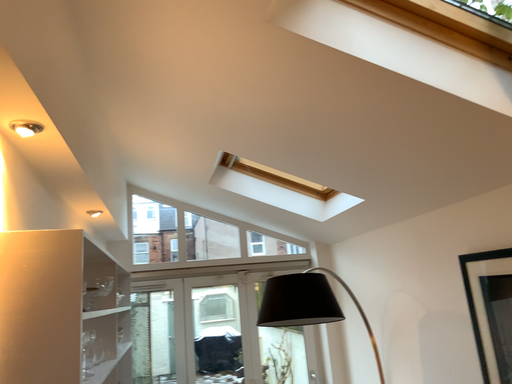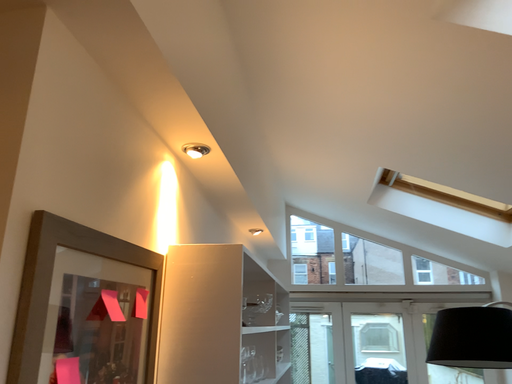
Question: How did the camera likely rotate when shooting the video?

Choices:
 (A) rotated right
 (B) rotated left

Answer: (B)